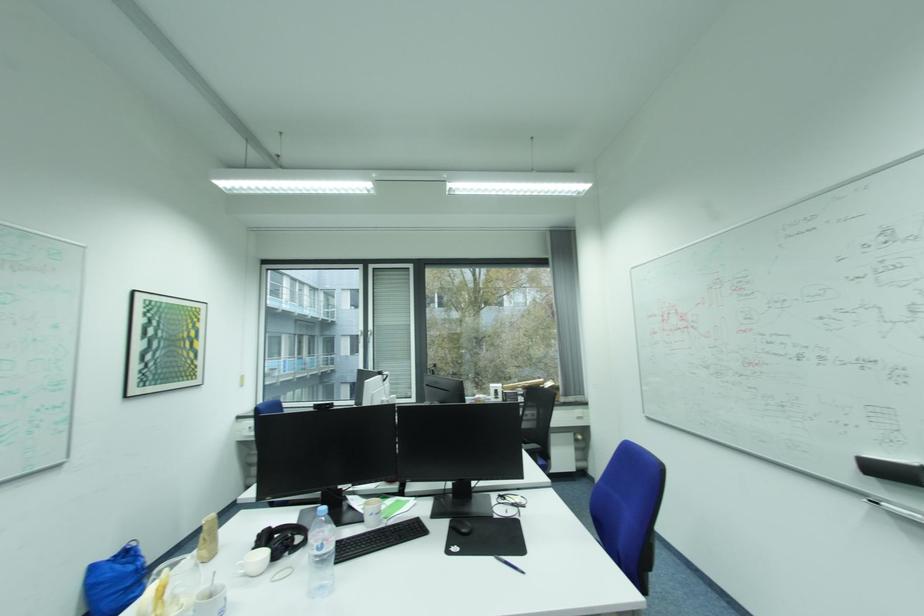
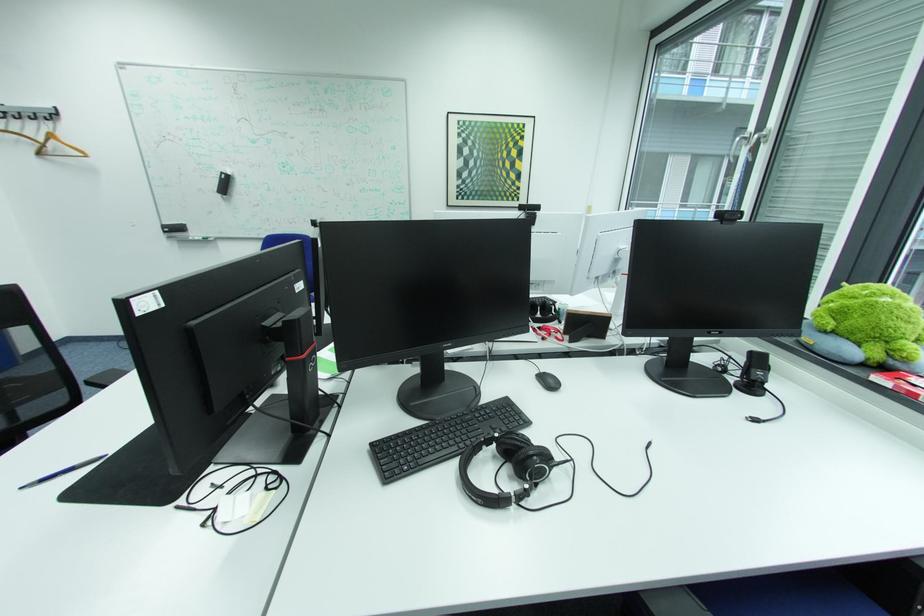
In the second image, find the point that corresponds to (528,516) in the first image.

(187, 508)